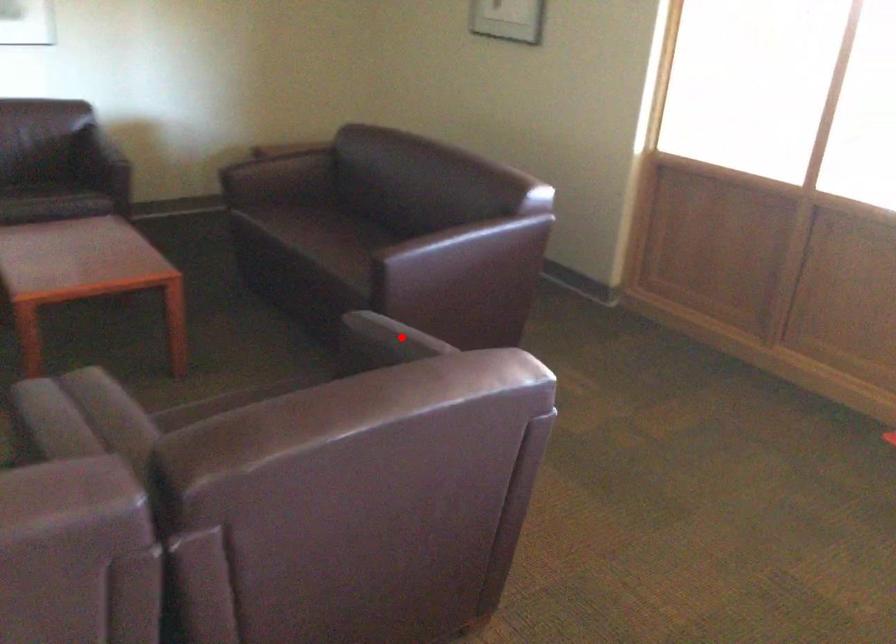
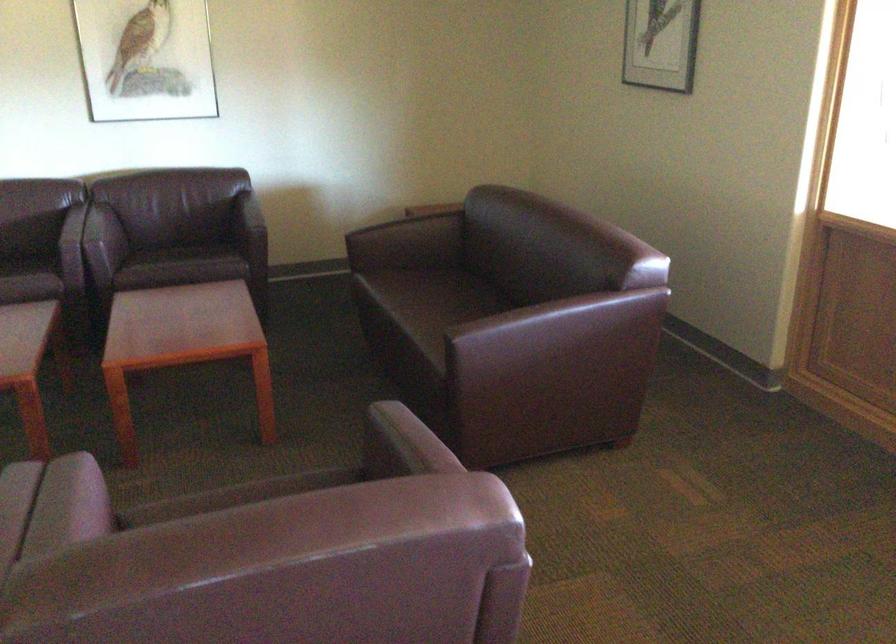
In the second image, find the point that corresponds to the highlighted location in the first image.

(390, 440)